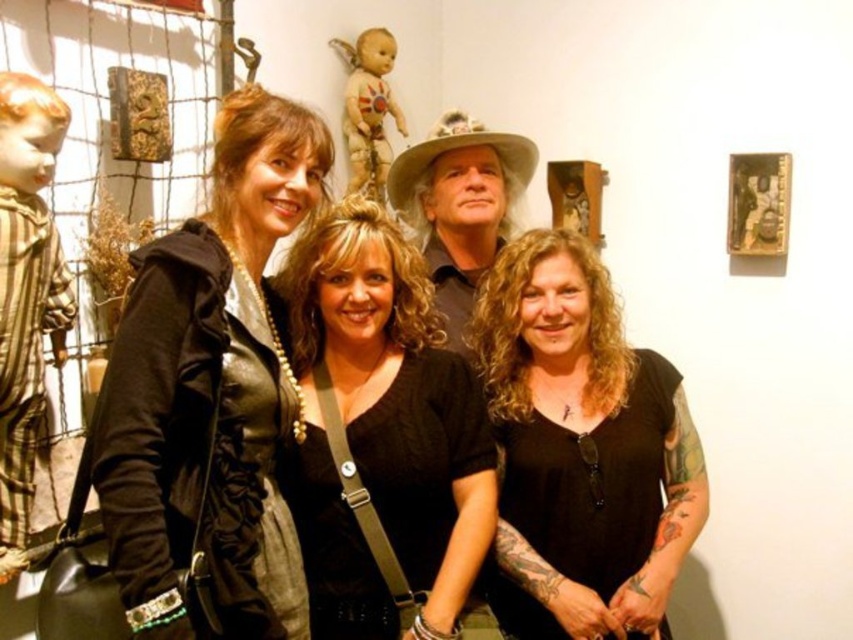
Question: Which object is farther from the camera taking this photo?

Choices:
 (A) black matte shirt at center
 (B) matte painted wood doll at upper center
 (C) striped fabric doll at left
 (D) leather jacket at center

Answer: (B)

Question: Is black leather top at center below matte black cowboy hat at center?

Choices:
 (A) yes
 (B) no

Answer: (A)

Question: Which of the following is the closest to the observer?

Choices:
 (A) striped fabric doll at left
 (B) matte painted wood doll at upper center
 (C) leather jacket at center

Answer: (C)

Question: Can you confirm if matte black shirt at center is wider than matte painted wood doll at upper center?

Choices:
 (A) no
 (B) yes

Answer: (B)

Question: Is black matte shirt at center smaller than striped fabric doll at left?

Choices:
 (A) no
 (B) yes

Answer: (A)

Question: Estimate the real-world distances between objects in this image. Which object is closer to the matte black shirt at center?

Choices:
 (A) leather jacket at center
 (B) black matte shirt at center
 (C) striped fabric doll at left

Answer: (B)